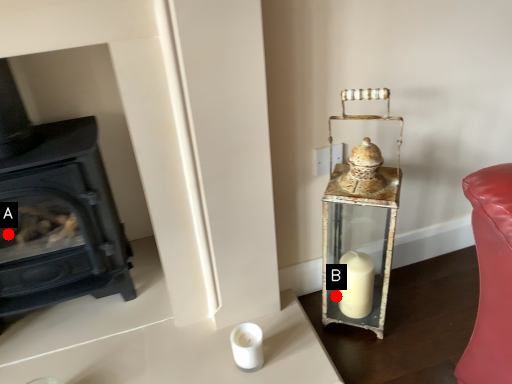
Question: Two points are circled on the image, labeled by A and B beside each circle. Among these points, which one is farthest from the camera?

Choices:
 (A) A is further
 (B) B is further

Answer: (B)